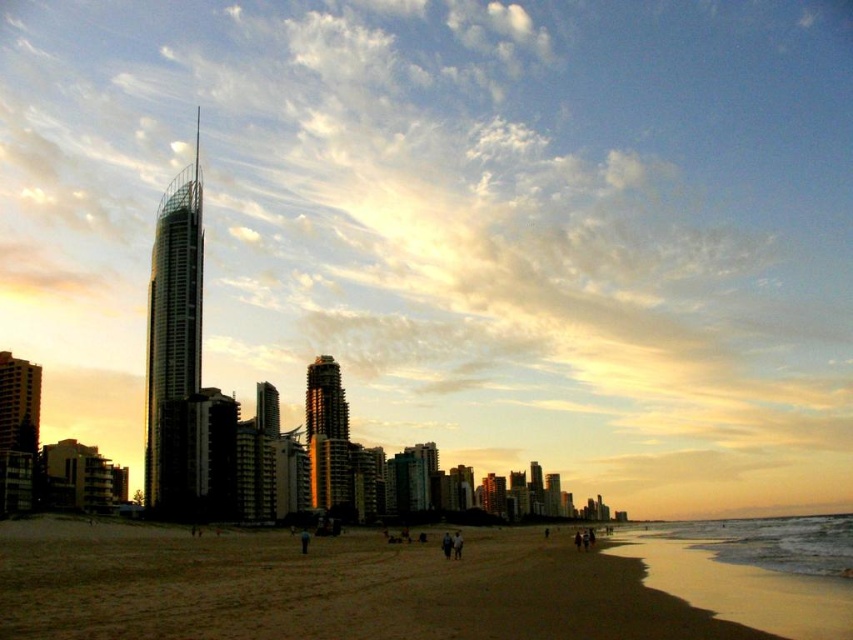
You are standing at the center of the beach scene. Which direction should you walk to reach the brown sand at lower left?

The brown sand at lower left is located at point [422,582], so you should walk towards the lower left direction to reach it.

You are standing on the beach and want to take a photo of both the shiny glass skyscraper at center and the gold reflective glass tower at center. Which one should you zoom in on first to ensure both are in frame?

You should zoom in on the shiny glass skyscraper at center first because it is closer to you than the gold reflective glass tower at center, so adjusting the zoom to include it will help frame both structures properly.